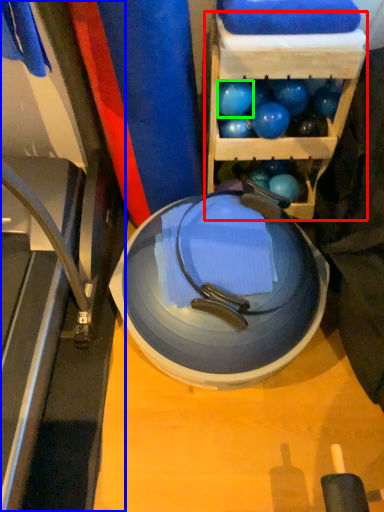
Question: Which object is the farthest from shelf (highlighted by a red box)? Choose among these: treadmill (highlighted by a blue box) or ball (highlighted by a green box).

Choices:
 (A) treadmill
 (B) ball

Answer: (A)